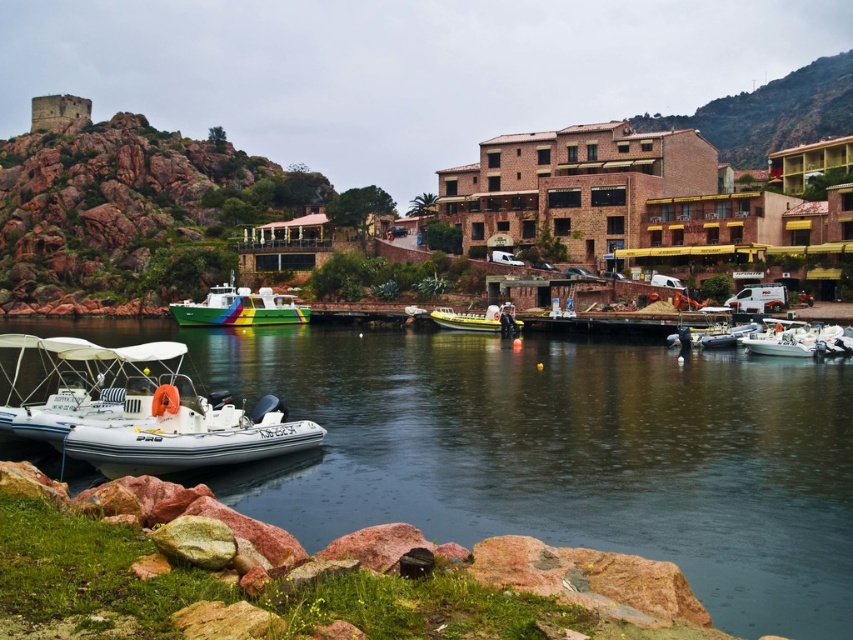
Question: Does rustic stone tower at upper left lie in front of yellow rubber boat at center?

Choices:
 (A) yes
 (B) no

Answer: (B)

Question: Does clear water at lower center lie in front of brown brick building at upper right?

Choices:
 (A) yes
 (B) no

Answer: (A)

Question: Based on their relative distances, which object is farther from the yellow rubber boat at center?

Choices:
 (A) rustic stone tower at upper left
 (B) white rubber boat at lower left
 (C) brown brick building at upper right

Answer: (C)

Question: Which point is farther from the camera taking this photo?

Choices:
 (A) (747, 342)
 (B) (201, 301)
 (C) (12, 381)

Answer: (B)

Question: Does brown brick building at upper right appear over white glossy boat at lower right?

Choices:
 (A) no
 (B) yes

Answer: (B)

Question: Which is farther from the clear water at lower center?

Choices:
 (A) white glossy boat at lower right
 (B) white rubber boat at lower left
 (C) green rubber boat at center

Answer: (C)